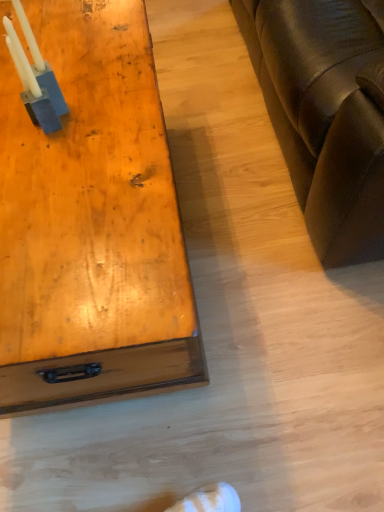
Identify the location of empty space that is to the right of wooden table at left. (241, 248).